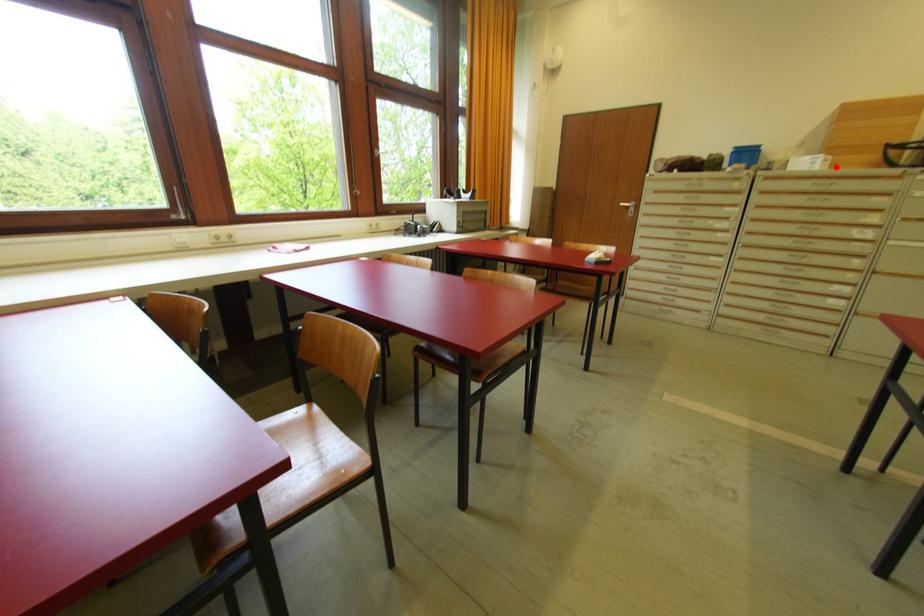
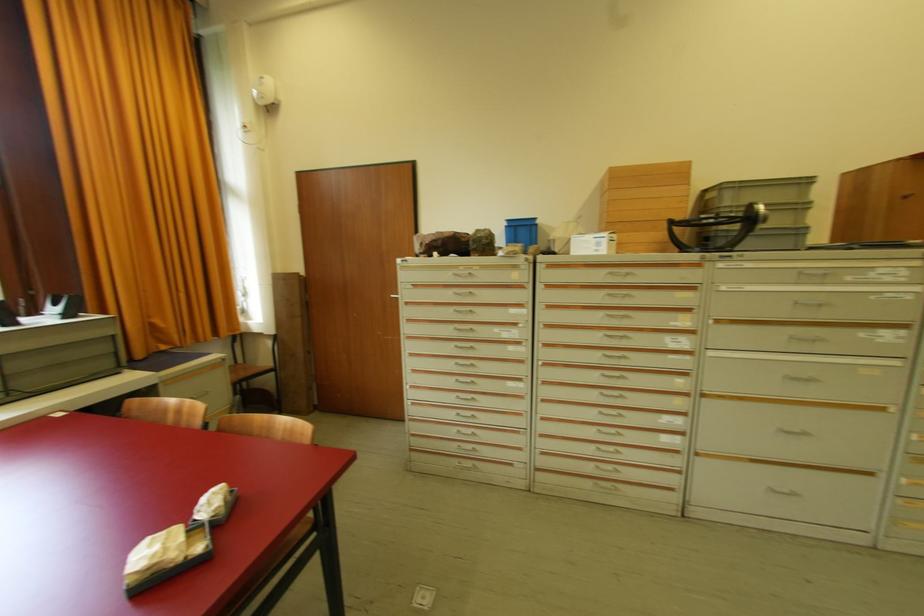
In the second image, find the point that corresponds to the highlighted location in the first image.

(623, 248)